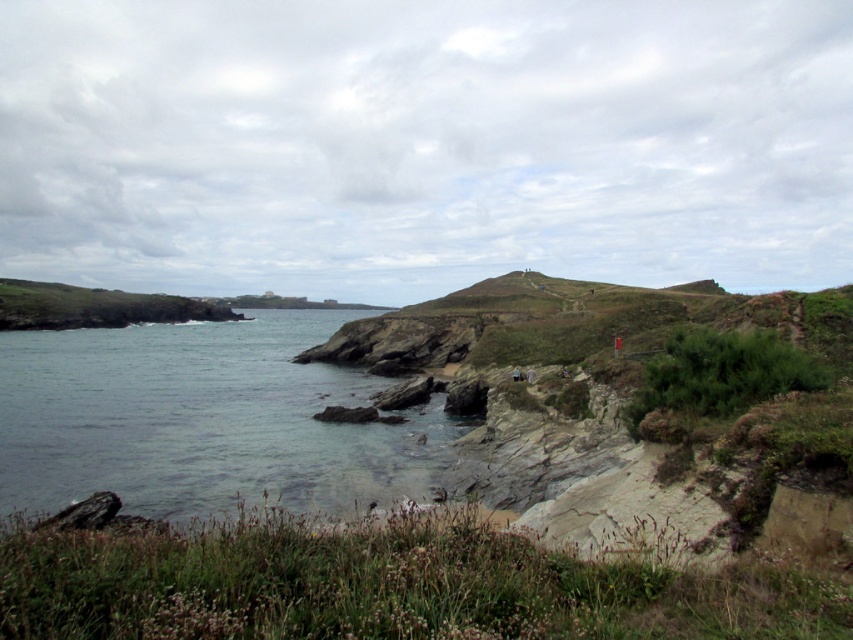
Question: Does clear water at lower left have a smaller size compared to green grassy hillside at left?

Choices:
 (A) yes
 (B) no

Answer: (A)

Question: Does clear water at lower left appear on the right side of green grassy hillside at left?

Choices:
 (A) no
 (B) yes

Answer: (B)

Question: Does clear water at lower left have a lesser width compared to green grassy hillside at left?

Choices:
 (A) no
 (B) yes

Answer: (A)

Question: Which of the following is the farthest from the observer?

Choices:
 (A) green grassy hillside at left
 (B) clear water at lower left

Answer: (A)